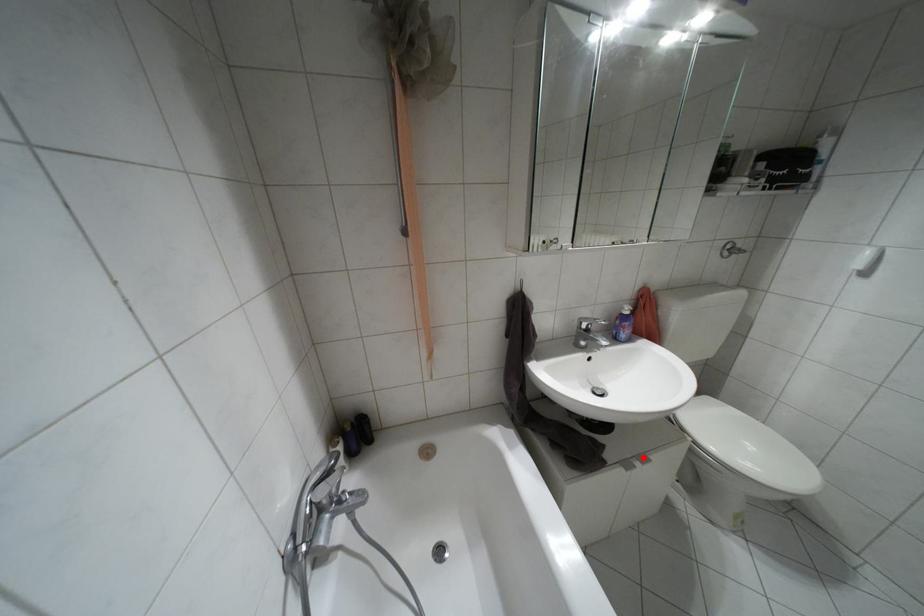
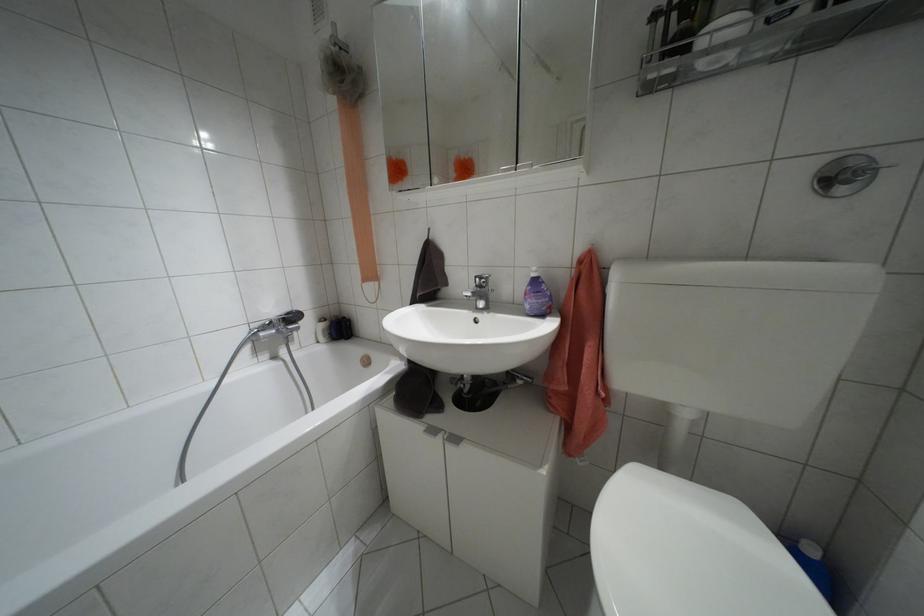
Question: I am providing you with two images of the same scene from different viewpoints. Given a red point in image1, look at the same physical point in image2. Is it:

Choices:
 (A) Closer to the viewpoint
 (B) Farther from the viewpoint

Answer: (A)